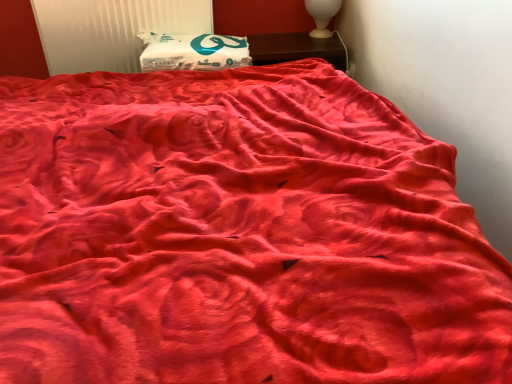
Question: Could you tell me if white glossy table lamp at upper right is turned towards white matte pillow at upper center?

Choices:
 (A) yes
 (B) no

Answer: (B)

Question: From the image's perspective, is white glossy table lamp at upper right under white matte pillow at upper center?

Choices:
 (A) yes
 (B) no

Answer: (B)

Question: Is white glossy table lamp at upper right at the right side of white matte pillow at upper center?

Choices:
 (A) yes
 (B) no

Answer: (A)

Question: Can you confirm if white glossy table lamp at upper right is smaller than white matte pillow at upper center?

Choices:
 (A) yes
 (B) no

Answer: (A)

Question: Is white glossy table lamp at upper right at the left side of white matte pillow at upper center?

Choices:
 (A) yes
 (B) no

Answer: (B)

Question: Considering the relative sizes of white glossy table lamp at upper right and white matte pillow at upper center in the image provided, is white glossy table lamp at upper right taller than white matte pillow at upper center?

Choices:
 (A) yes
 (B) no

Answer: (A)

Question: Is white matte pillow at upper center to the left of white glossy table lamp at upper right from the viewer's perspective?

Choices:
 (A) no
 (B) yes

Answer: (B)

Question: Does white matte pillow at upper center have a greater width compared to white glossy table lamp at upper right?

Choices:
 (A) no
 (B) yes

Answer: (B)

Question: Considering the relative sizes of white matte pillow at upper center and white glossy table lamp at upper right in the image provided, is white matte pillow at upper center shorter than white glossy table lamp at upper right?

Choices:
 (A) yes
 (B) no

Answer: (A)

Question: From the image's perspective, would you say white matte pillow at upper center is shown under white glossy table lamp at upper right?

Choices:
 (A) no
 (B) yes

Answer: (B)

Question: Is white matte pillow at upper center further to camera compared to white glossy table lamp at upper right?

Choices:
 (A) yes
 (B) no

Answer: (B)

Question: Does white matte pillow at upper center lie in front of white glossy table lamp at upper right?

Choices:
 (A) no
 (B) yes

Answer: (B)

Question: Is white plastic radiator at upper left a part of wooden nightstand at upper center?

Choices:
 (A) no
 (B) yes

Answer: (A)